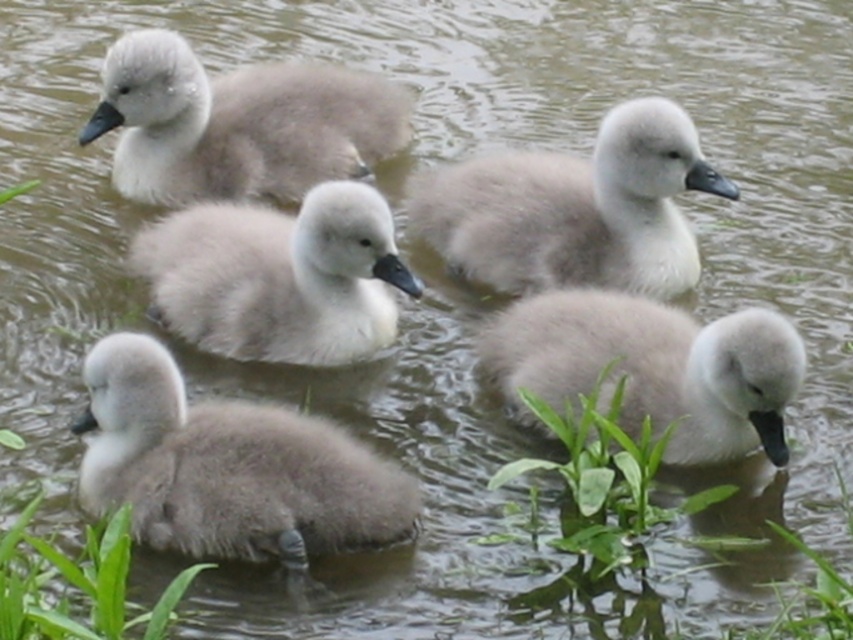
Who is shorter, fluffy gray swan at center or gray fluffy swan at lower right?

gray fluffy swan at lower right

Who is positioned more to the right, fluffy gray swan at center or gray fluffy swan at lower right?

gray fluffy swan at lower right

Between point (262, 310) and point (714, 324), which one is positioned behind?

Positioned behind is point (262, 310).

In order to click on fluffy gray swan at center in this screenshot , I will do `click(277, 276)`.

Between point (537, 168) and point (405, 280), which one is positioned in front?

Positioned in front is point (405, 280).

Between gray fluffy swan at center and fluffy gray swan at center, which one is positioned lower?

fluffy gray swan at center is below.

Who is more forward, (430, 170) or (170, 262)?

Positioned in front is point (170, 262).

At what (x,y) coordinates should I click in order to perform the action: click on gray fluffy swan at center. Please return your answer as a coordinate pair (x, y). Looking at the image, I should click on (573, 209).

Can you confirm if gray fluffy swan at upper left is positioned to the left of gray fluffy swan at lower right?

Yes, gray fluffy swan at upper left is to the left of gray fluffy swan at lower right.

In the scene shown: Can you confirm if gray fluffy swan at upper left is positioned to the right of gray fluffy swan at lower right?

No, gray fluffy swan at upper left is not to the right of gray fluffy swan at lower right.

What do you see at coordinates (238, 124) in the screenshot?
I see `gray fluffy swan at upper left` at bounding box center [238, 124].

You are a GUI agent. You are given a task and a screenshot of the screen. Output one action in this format:
    pyautogui.click(x=<x>, y=<y>)
    Task: Click on the gray fluffy swan at upper left
    
    Given the screenshot: What is the action you would take?
    pyautogui.click(x=238, y=124)